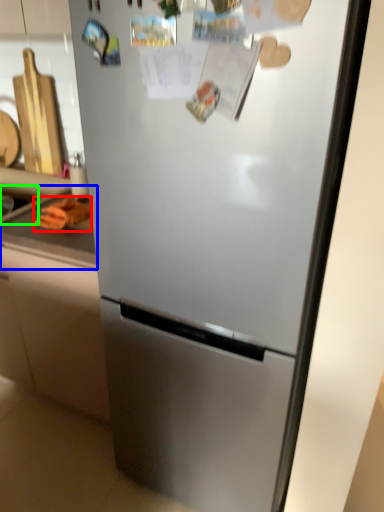
Question: Which object is positioned farthest from food (highlighted by a red box)? Select from counter top (highlighted by a blue box) and sink (highlighted by a green box).

Choices:
 (A) counter top
 (B) sink

Answer: (B)